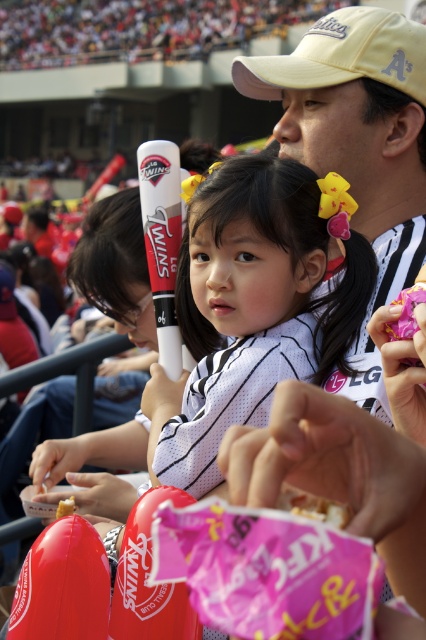
You are organizing a childrens party and have both a white matte baseball bat at center and a yellow sponge cake at center. If you want to place them on a shelf that can only hold items up to 15 cm wide, which item is more likely to fit?

The yellow sponge cake at center is more likely to fit on the shelf since its width is smaller than the white matte baseball bat at center, which exceeds the 15 cm limit.

You are a photographer at the baseball game and want to take a photo of both the yellow fabric baseball cap at upper center and the yellow sponge cake at center. Which object should you focus on first to ensure both are in clear view?

You should focus on the yellow fabric baseball cap at upper center first because it is closer to you than the yellow sponge cake at center. By focusing on the closer object, the background object will also be in focus due to the depth of field.